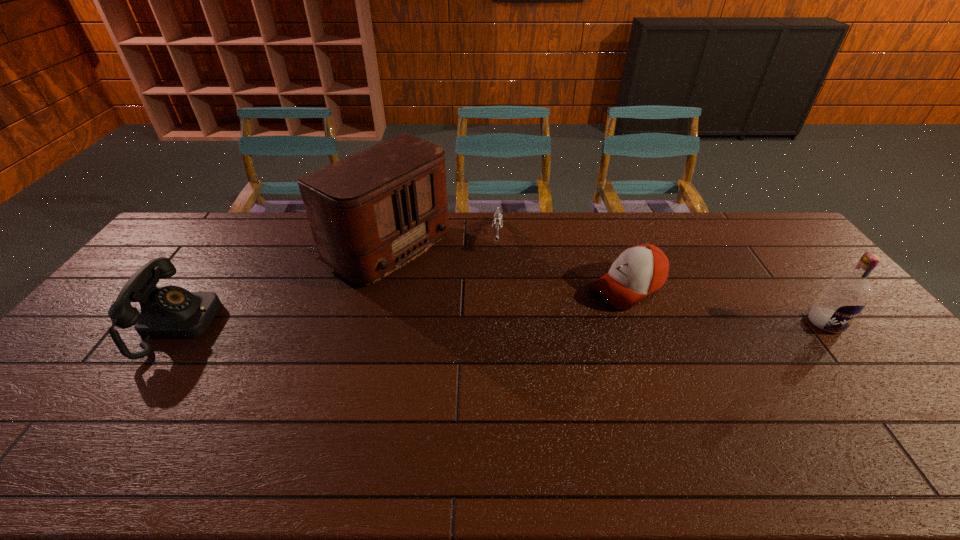
You are a GUI agent. You are given a task and a screenshot of the screen. Output one action in this format:
    pyautogui.click(x=<x>, y=<y>)
    Task: Click on the free space between the third shortest object and the fourth object from right to left
    This screenshot has height=540, width=960.
    Given the screenshot: What is the action you would take?
    pyautogui.click(x=277, y=286)

Identify the location of free space between the fourth object from left to right and the leftmost object. (403, 306).

The image size is (960, 540). I want to click on vacant region between the fourth tallest object and the vodka, so click(727, 305).

Locate an element on the screen. This screenshot has width=960, height=540. free space between the leftmost object and the gun is located at coordinates (338, 280).

Choose which object is the nearest neighbor to the gun. Please provide its 2D coordinates. Your answer should be formatted as a tuple, i.e. [(x, y)], where the tuple contains the x and y coordinates of a point satisfying the conditions above.

[(371, 213)]

Identify which object is the fourth nearest to the shortest object. Please provide its 2D coordinates. Your answer should be formatted as a tuple, i.e. [(x, y)], where the tuple contains the x and y coordinates of a point satisfying the conditions above.

[(845, 295)]